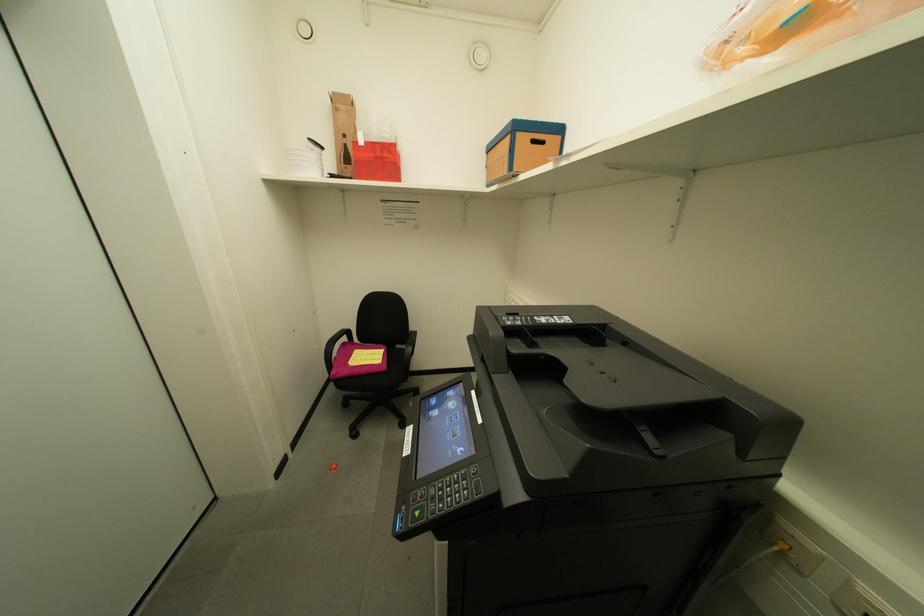
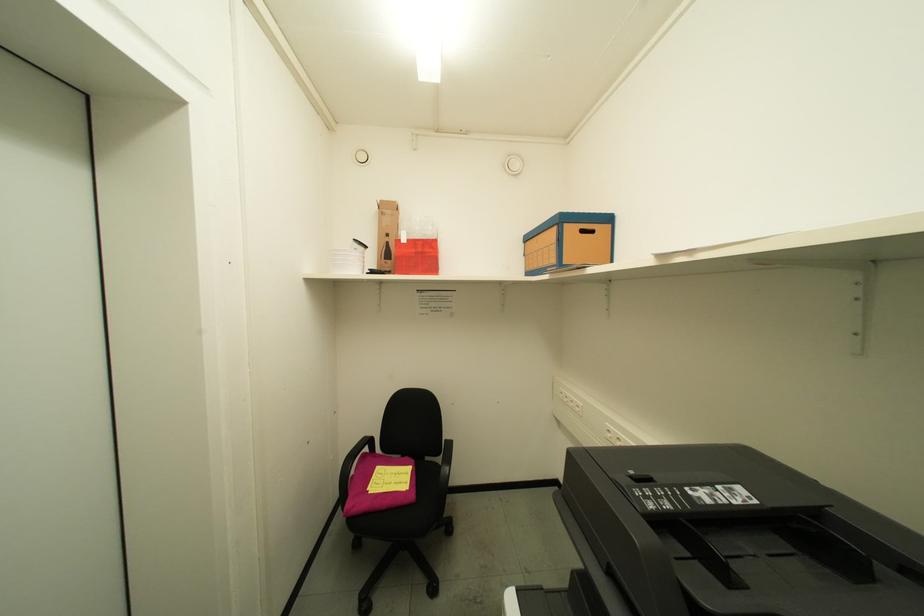
What movement of the cameraman would produce the second image?

The cameraman walked toward left, forward.